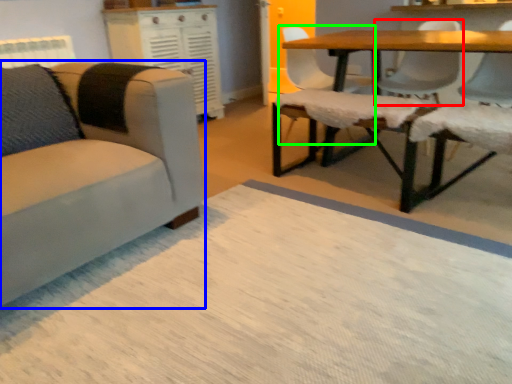
Question: Which is nearer to the chair (highlighted by a red box)? chair (highlighted by a blue box) or chair (highlighted by a green box).

Choices:
 (A) chair
 (B) chair

Answer: (B)